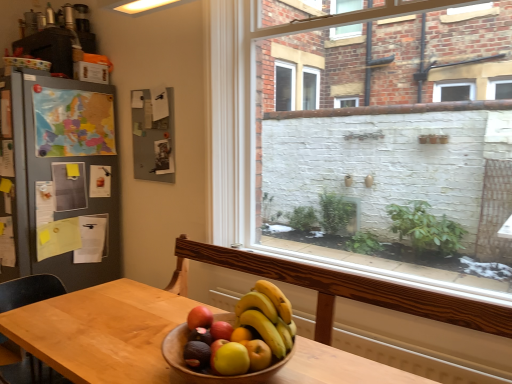
Identify the location of empty space that is ontop of wooden bowl at center (from a real-world perspective). The image size is (512, 384). (222, 332).